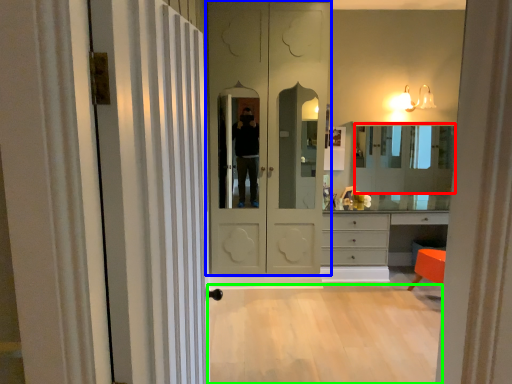
Question: Based on their relative distances, which object is nearer to mirror (highlighted by a red box)? Choose from door (highlighted by a blue box) and plain (highlighted by a green box).

Choices:
 (A) door
 (B) plain

Answer: (A)